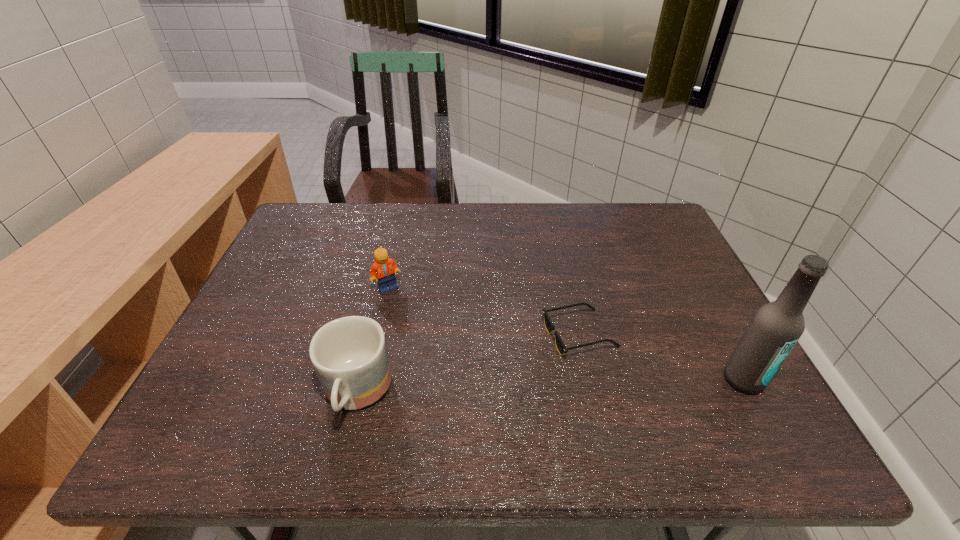
At what (x,y) coordinates should I click in order to perform the action: click on free location located on the lenses of the third object from left to right. Please return your answer as a coordinate pair (x, y). The image size is (960, 540). Looking at the image, I should click on (493, 406).

This screenshot has width=960, height=540. I want to click on vacant area situated on the lenses of the third object from left to right, so click(523, 381).

Locate an element on the screen. mug that is at the near edge is located at coordinates (349, 354).

Identify the location of beer bottle at the near edge. (775, 328).

The image size is (960, 540). I want to click on object positioned at the right edge, so pyautogui.click(x=775, y=328).

At what (x,y) coordinates should I click in order to perform the action: click on object situated at the near right corner. Please return your answer as a coordinate pair (x, y). This screenshot has height=540, width=960. Looking at the image, I should click on (775, 328).

The width and height of the screenshot is (960, 540). In the image, there is a desktop. What are the coordinates of `free space at the far edge` in the screenshot? It's located at (520, 240).

At what (x,y) coordinates should I click in order to perform the action: click on blank space at the near edge of the desktop. Please return your answer as a coordinate pair (x, y). This screenshot has height=540, width=960. Looking at the image, I should click on (558, 407).

Locate an element on the screen. This screenshot has height=540, width=960. free location at the right edge of the desktop is located at coordinates (663, 270).

Image resolution: width=960 pixels, height=540 pixels. In the image, there is a desktop. Find the location of `vacant area at the far left corner`. vacant area at the far left corner is located at coordinates (330, 206).